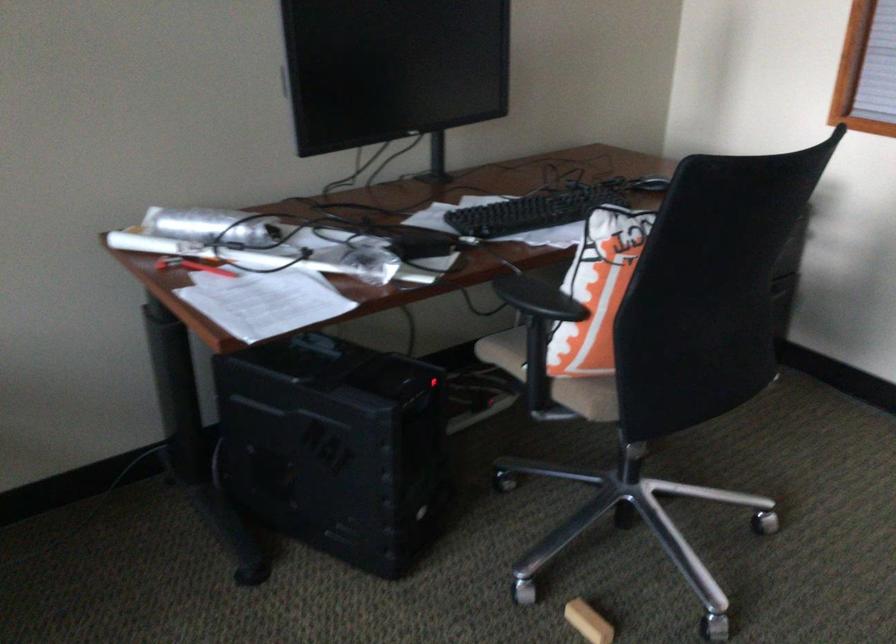
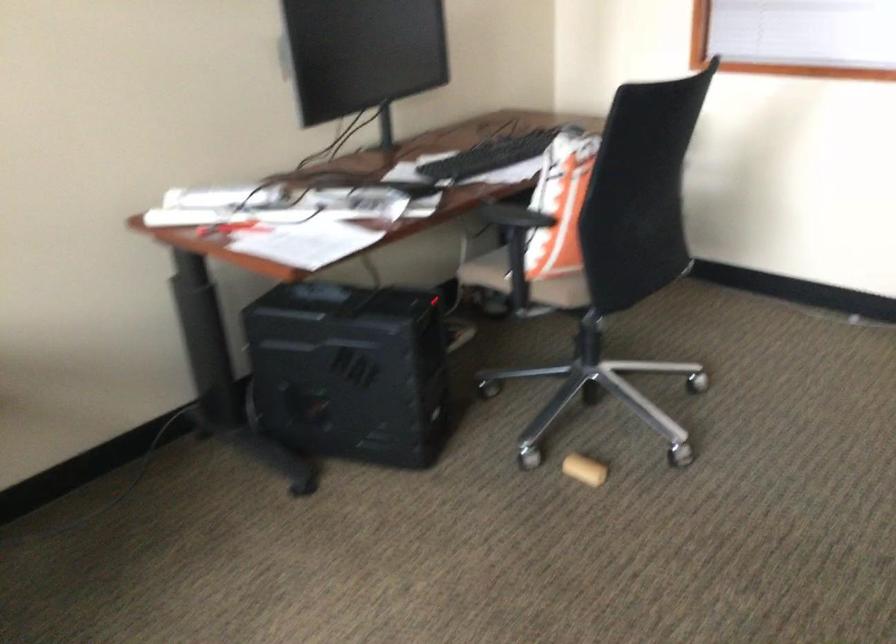
Question: The images are taken continuously from a first-person perspective. In which direction is your viewpoint rotating?

Choices:
 (A) Left
 (B) Right
 (C) Up
 (D) Down

Answer: (B)